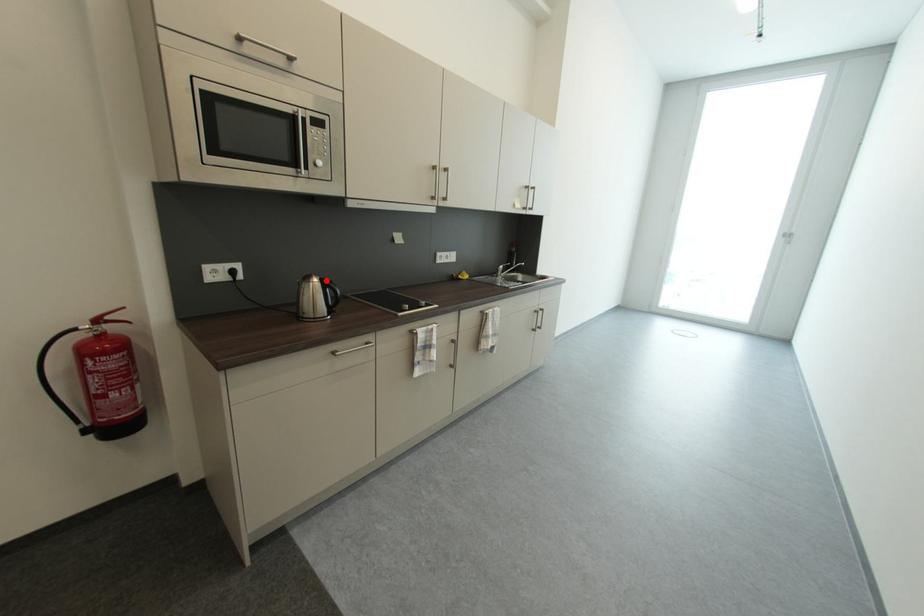
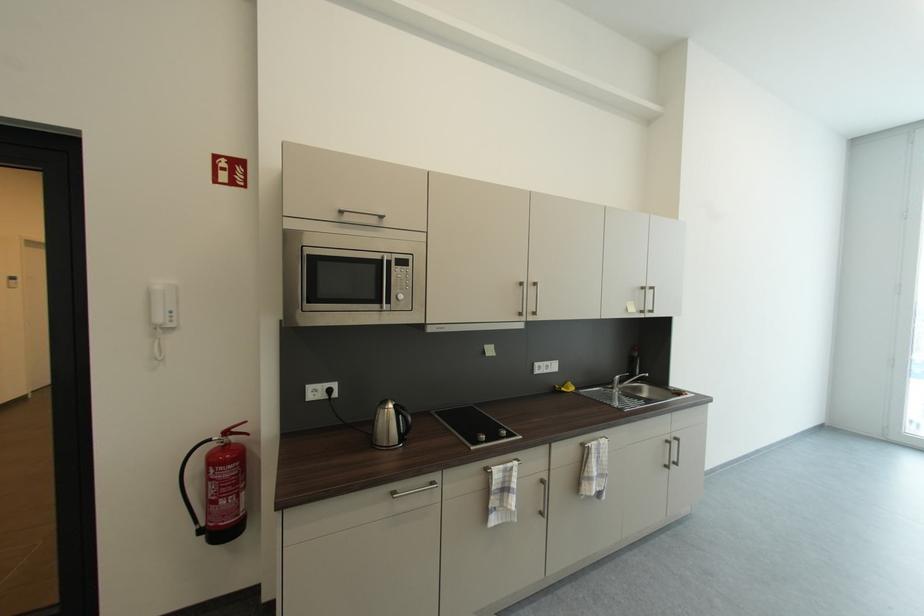
Question: I am providing you with two images of the same scene from different viewpoints. In image1, a red point is highlighted. Considering the same 3D point in image2, which of the following is correct?

Choices:
 (A) It is closer
 (B) It is farther

Answer: (B)